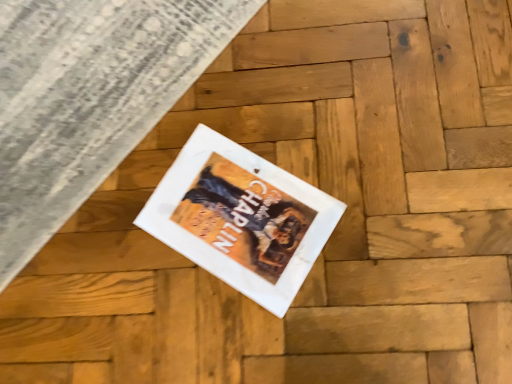
The image size is (512, 384). I want to click on free location to the right of white matte picture frame at center, so click(354, 152).